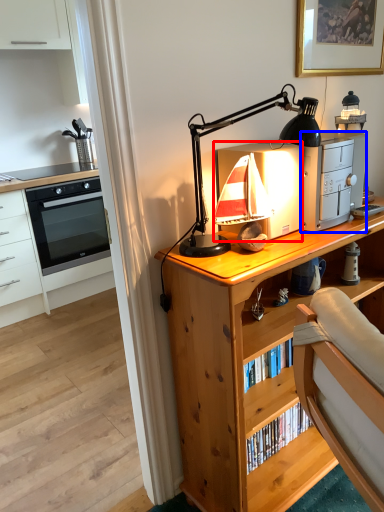
Question: Which object appears closest to the camera in this image, appliance (highlighted by a red box) or appliance (highlighted by a blue box)?

Choices:
 (A) appliance
 (B) appliance

Answer: (A)